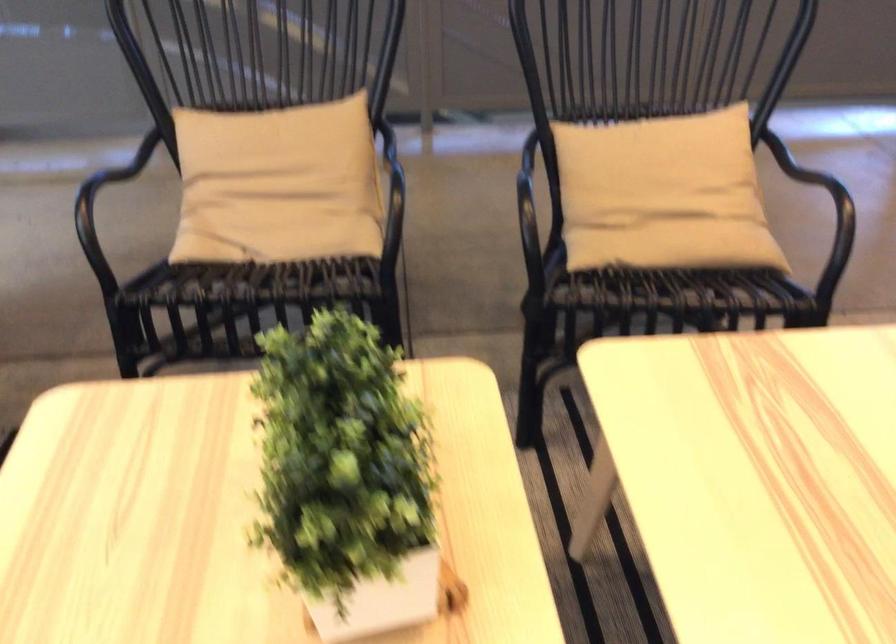
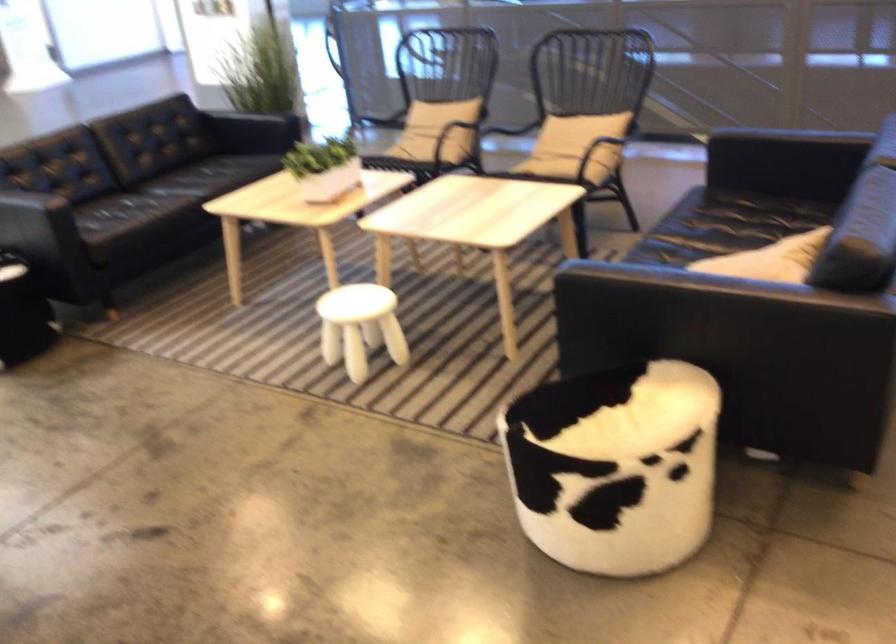
Where in the second image is the point corresponding to (270,278) from the first image?

(401, 163)